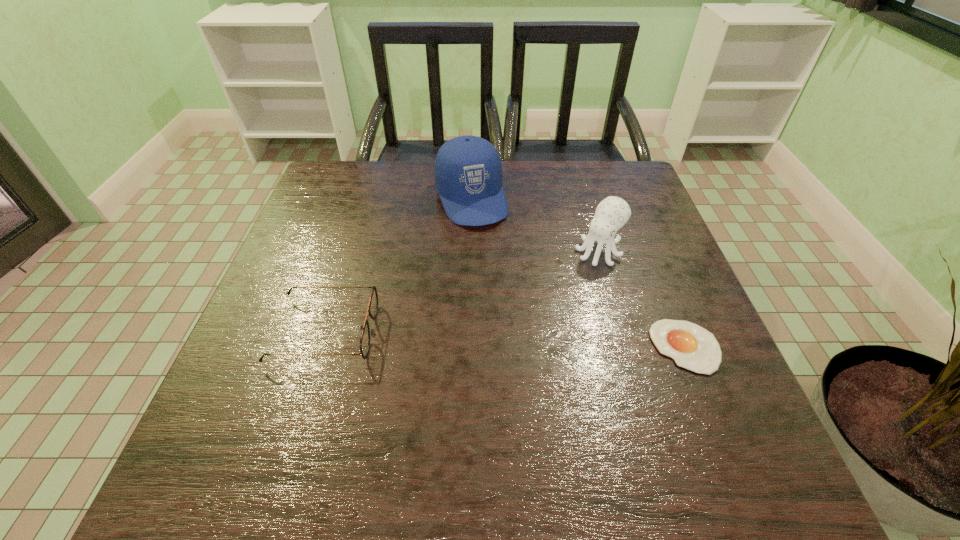
In the image, there is a desktop. Identify the location of vacant space at the left edge. This screenshot has height=540, width=960. (312, 258).

Where is `blank area at the right edge`? The height and width of the screenshot is (540, 960). blank area at the right edge is located at coordinates (644, 346).

This screenshot has width=960, height=540. What are the coordinates of `free spot at the far left corner of the desktop` in the screenshot? It's located at (339, 193).

At what (x,y) coordinates should I click in order to perform the action: click on vacant space at the near left corner of the desktop. Please return your answer as a coordinate pair (x, y). Looking at the image, I should click on [240, 404].

Find the location of a particular element. The image size is (960, 540). free space at the far right corner of the desktop is located at coordinates (590, 172).

Identify the location of vacant area that lies between the octopus and the sunglasses. The height and width of the screenshot is (540, 960). (462, 292).

Where is `empty space that is in between the leftmost object and the cap`? empty space that is in between the leftmost object and the cap is located at coordinates (398, 265).

Identify the location of empty space between the leftmost object and the egg yolk. This screenshot has width=960, height=540. (506, 339).

Where is `free space that is in between the second farthest object and the farthest object`? The width and height of the screenshot is (960, 540). free space that is in between the second farthest object and the farthest object is located at coordinates (535, 225).

Find the location of a particular element. free spot between the farthest object and the second farthest object is located at coordinates click(x=535, y=225).